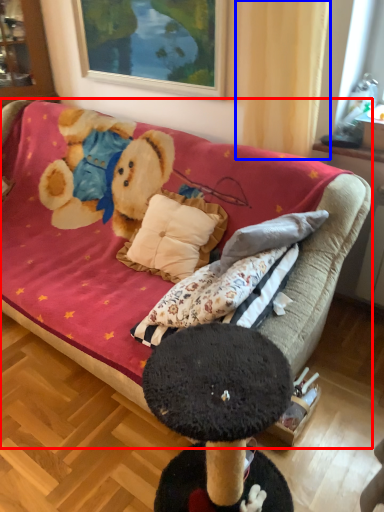
Question: Which point is closer to the camera, studio couch (highlighted by a red box) or curtain (highlighted by a blue box)?

Choices:
 (A) studio couch
 (B) curtain

Answer: (A)